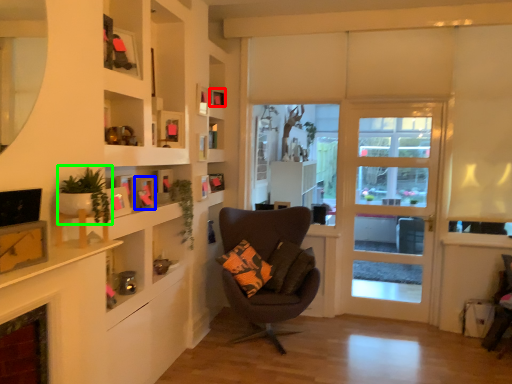
Question: Considering the real-world distances, which object is farthest from picture frame (highlighted by a red box)? picture frame (highlighted by a blue box) or plant (highlighted by a green box)?

Choices:
 (A) picture frame
 (B) plant

Answer: (B)